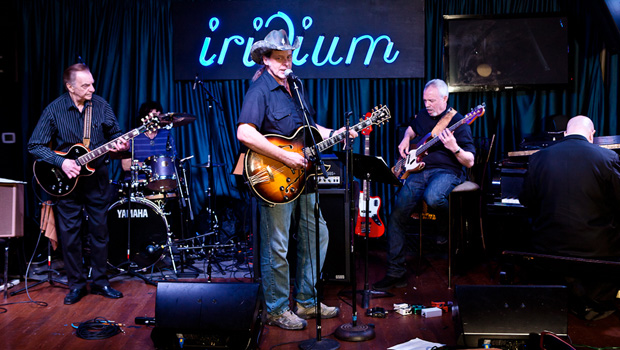
The image size is (620, 350). In order to click on hardwood floor in this screenshot , I will do (x=45, y=334), (x=118, y=307), (x=394, y=328).